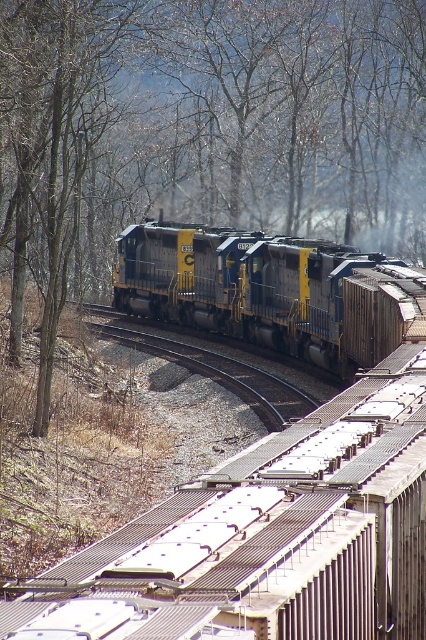
Question: Which point is closer to the camera taking this photo?

Choices:
 (A) (264, 240)
 (B) (276, 387)
 (C) (112, 161)

Answer: (B)

Question: Can you confirm if brown bark tree at upper left is positioned below metal/smooth train track at center?

Choices:
 (A) yes
 (B) no

Answer: (B)

Question: Is brown bark tree at upper left further to the viewer compared to metal/smooth train track at center?

Choices:
 (A) yes
 (B) no

Answer: (B)

Question: Which object is farther from the camera taking this photo?

Choices:
 (A) blue/yellow locomotive at center
 (B) brown bark tree at upper left

Answer: (A)

Question: Estimate the real-world distances between objects in this image. Which object is closer to the brown bark tree at upper left?

Choices:
 (A) metal/smooth train track at center
 (B) blue/yellow locomotive at center

Answer: (B)

Question: Can you confirm if brown bark tree at upper left is bigger than blue/yellow locomotive at center?

Choices:
 (A) no
 (B) yes

Answer: (B)